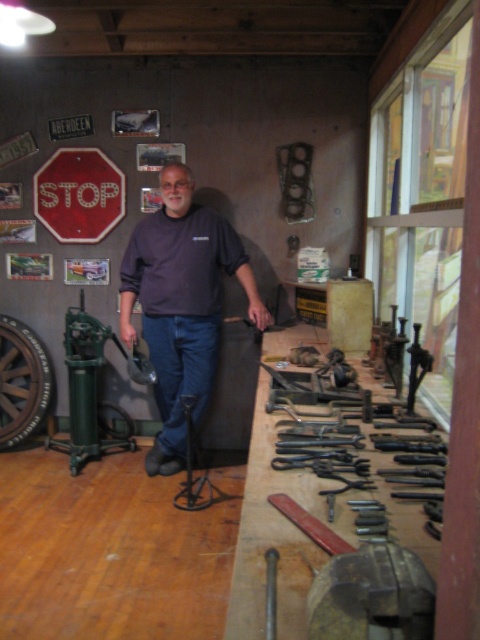
Question: Which point is closer to the camera taking this photo?

Choices:
 (A) (103, 420)
 (B) (94, 225)
 (C) (271, 636)
 (D) (130, 240)

Answer: (C)

Question: Which point is farther from the camera taking this photo?

Choices:
 (A) (276, 618)
 (B) (91, 448)
 (C) (184, 444)

Answer: (B)

Question: Is dark blue shirt at center bigger than green metal pump at left?

Choices:
 (A) yes
 (B) no

Answer: (A)

Question: Is dark blue shirt at center wider than red matte stop sign at center?

Choices:
 (A) no
 (B) yes

Answer: (B)

Question: Does dark blue shirt at center have a lesser width compared to metallic flat at center?

Choices:
 (A) yes
 (B) no

Answer: (B)

Question: Which object appears farthest from the camera in this image?

Choices:
 (A) dark blue shirt at center
 (B) red matte stop sign at center

Answer: (B)